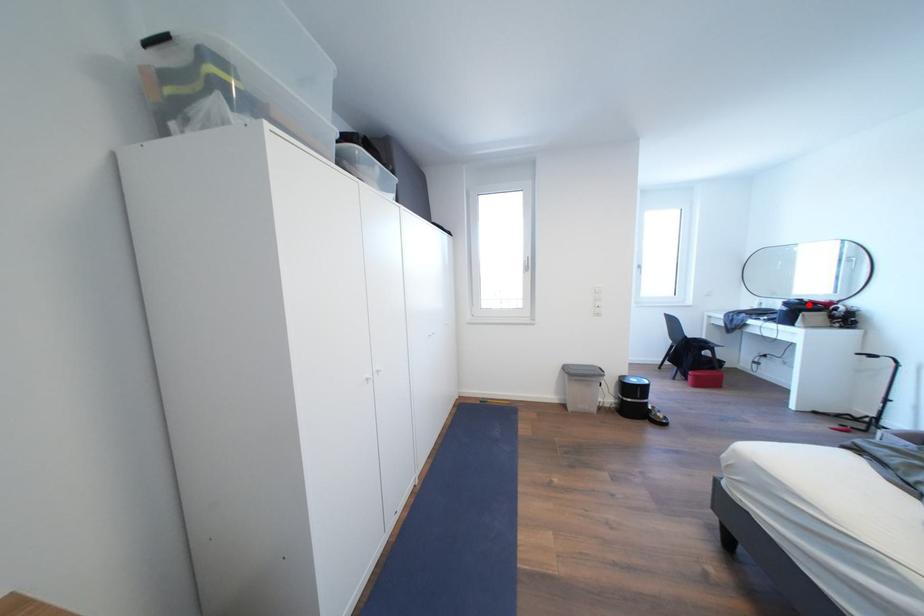
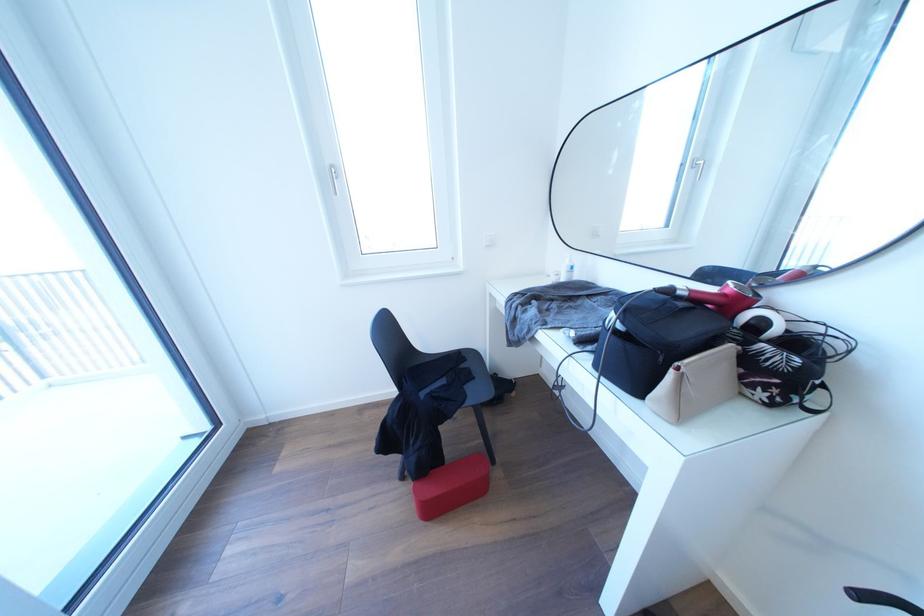
The point at the highlighted location is marked in the first image. Where is the corresponding point in the second image?

(675, 296)